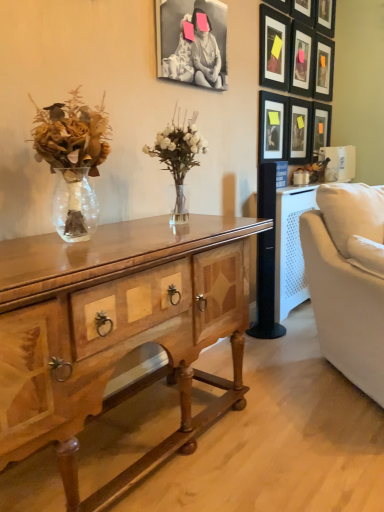
Question: Is matte black picture frame at upper right, which ranks as the ninth picture frame in left-to-right order, positioned behind wooden desk at center?

Choices:
 (A) yes
 (B) no

Answer: (A)

Question: Is matte black picture frame at upper right, which ranks as the ninth picture frame in left-to-right order, aimed at wooden desk at center?

Choices:
 (A) yes
 (B) no

Answer: (B)

Question: Considering the relative positions of matte black picture frame at upper right, which ranks as the ninth picture frame in left-to-right order, and wooden desk at center in the image provided, is matte black picture frame at upper right, which ranks as the ninth picture frame in left-to-right order, to the right of wooden desk at center from the viewer's perspective?

Choices:
 (A) no
 (B) yes

Answer: (B)

Question: Is matte black picture frame at upper right, the first picture frame viewed from the right, thinner than wooden desk at center?

Choices:
 (A) yes
 (B) no

Answer: (A)

Question: From the image's perspective, is matte black picture frame at upper right, the first picture frame viewed from the right, located beneath wooden desk at center?

Choices:
 (A) no
 (B) yes

Answer: (A)

Question: Is matte black picture frame at upper right, which appears as the sixth picture frame when viewed from the left, situated inside black matte picture frame at upper center, which is the 9th picture frame in right-to-left order, or outside?

Choices:
 (A) inside
 (B) outside

Answer: (B)

Question: From their relative heights in the image, would you say matte black picture frame at upper right, which appears as the sixth picture frame when viewed from the left, is taller or shorter than black matte picture frame at upper center, which is the 9th picture frame in right-to-left order?

Choices:
 (A) tall
 (B) short

Answer: (A)

Question: Considering the relative positions of matte black picture frame at upper right, which ranks as the fourth picture frame in right-to-left order, and black matte picture frame at upper center, which is the 9th picture frame in right-to-left order, in the image provided, is matte black picture frame at upper right, which ranks as the fourth picture frame in right-to-left order, to the left or to the right of black matte picture frame at upper center, which is the 9th picture frame in right-to-left order,?

Choices:
 (A) right
 (B) left

Answer: (A)

Question: From the image's perspective, is matte black picture frame at upper right, which appears as the sixth picture frame when viewed from the left, above or below black matte picture frame at upper center, which is the 9th picture frame in right-to-left order?

Choices:
 (A) above
 (B) below

Answer: (B)

Question: From the image's perspective, is wooden picture frame at upper right, positioned as the sixth picture frame in right-to-left order, above or below wooden picture frame at upper right, which ranks as the seventh picture frame in left-to-right order?

Choices:
 (A) above
 (B) below

Answer: (B)

Question: From a real-world perspective, is wooden picture frame at upper right, positioned as the sixth picture frame in right-to-left order, physically located above or below wooden picture frame at upper right, which ranks as the seventh picture frame in left-to-right order?

Choices:
 (A) above
 (B) below

Answer: (B)

Question: Is wooden picture frame at upper right, which is the fourth picture frame in left-to-right order, wider or thinner than wooden picture frame at upper right, which is the third picture frame in right-to-left order?

Choices:
 (A) wide
 (B) thin

Answer: (B)

Question: In the image, is wooden picture frame at upper right, which is the fourth picture frame in left-to-right order, on the left side or the right side of wooden picture frame at upper right, which ranks as the seventh picture frame in left-to-right order?

Choices:
 (A) left
 (B) right

Answer: (A)

Question: In terms of width, does matte black picture frame at upper right, the first picture frame viewed from the right, look wider or thinner when compared to matte black picture frame at upper right, the third picture frame viewed from the left?

Choices:
 (A) wide
 (B) thin

Answer: (B)

Question: Which is correct: matte black picture frame at upper right, the first picture frame viewed from the right, is inside matte black picture frame at upper right, the seventh picture frame in the right-to-left sequence, or outside of it?

Choices:
 (A) inside
 (B) outside

Answer: (B)